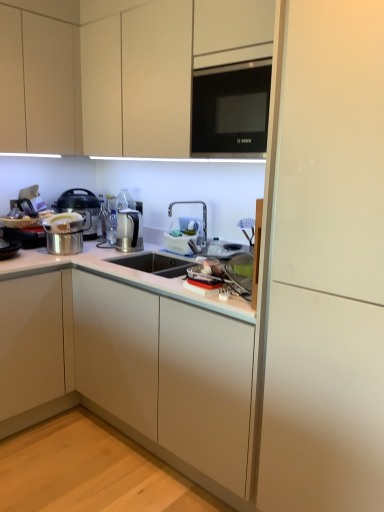
Question: Considering the relative sizes of black glass microwave at upper center and white glossy cabinet at center, which appears as the 1th cabinetry when ordered from the bottom, in the image provided, is black glass microwave at upper center wider than white glossy cabinet at center, which appears as the 1th cabinetry when ordered from the bottom,?

Choices:
 (A) no
 (B) yes

Answer: (A)

Question: Is black glass microwave at upper center outside of white glossy cabinet at center, the second cabinetry when ordered from top to bottom?

Choices:
 (A) yes
 (B) no

Answer: (A)

Question: From a real-world perspective, is black glass microwave at upper center physically above white glossy cabinet at center, which appears as the 1th cabinetry when ordered from the bottom?

Choices:
 (A) no
 (B) yes

Answer: (B)

Question: Are black glass microwave at upper center and white glossy cabinet at center, which appears as the 1th cabinetry when ordered from the bottom, located far from each other?

Choices:
 (A) yes
 (B) no

Answer: (B)

Question: Does black glass microwave at upper center appear on the right side of white glossy cabinet at center, which appears as the 1th cabinetry when ordered from the bottom?

Choices:
 (A) no
 (B) yes

Answer: (B)

Question: From the image's perspective, is metallic silver pressure cooker at left positioned above or below white plastic basket at center?

Choices:
 (A) above
 (B) below

Answer: (A)

Question: From a real-world perspective, is metallic silver pressure cooker at left positioned above or below white plastic basket at center?

Choices:
 (A) below
 (B) above

Answer: (B)

Question: Considering the positions of metallic silver pressure cooker at left and white plastic basket at center in the image, is metallic silver pressure cooker at left taller or shorter than white plastic basket at center?

Choices:
 (A) tall
 (B) short

Answer: (A)

Question: Is metallic silver pressure cooker at left to the left or to the right of white plastic basket at center in the image?

Choices:
 (A) left
 (B) right

Answer: (A)

Question: From a real-world perspective, relative to black glass microwave at upper center, is white matte cabinet at right vertically above or below?

Choices:
 (A) above
 (B) below

Answer: (B)

Question: From the image's perspective, is white matte cabinet at right positioned above or below black glass microwave at upper center?

Choices:
 (A) below
 (B) above

Answer: (A)

Question: In terms of width, does white matte cabinet at right look wider or thinner when compared to black glass microwave at upper center?

Choices:
 (A) wide
 (B) thin

Answer: (A)

Question: Is white matte cabinet at right in front of or behind black glass microwave at upper center in the image?

Choices:
 (A) behind
 (B) front

Answer: (B)

Question: In the image, is white plastic basket at center positioned in front of or behind white glossy cabinet at center, the second cabinetry when ordered from top to bottom?

Choices:
 (A) behind
 (B) front

Answer: (A)

Question: Do you think white plastic basket at center is within white glossy cabinet at center, which appears as the 1th cabinetry when ordered from the bottom, or outside of it?

Choices:
 (A) inside
 (B) outside

Answer: (B)